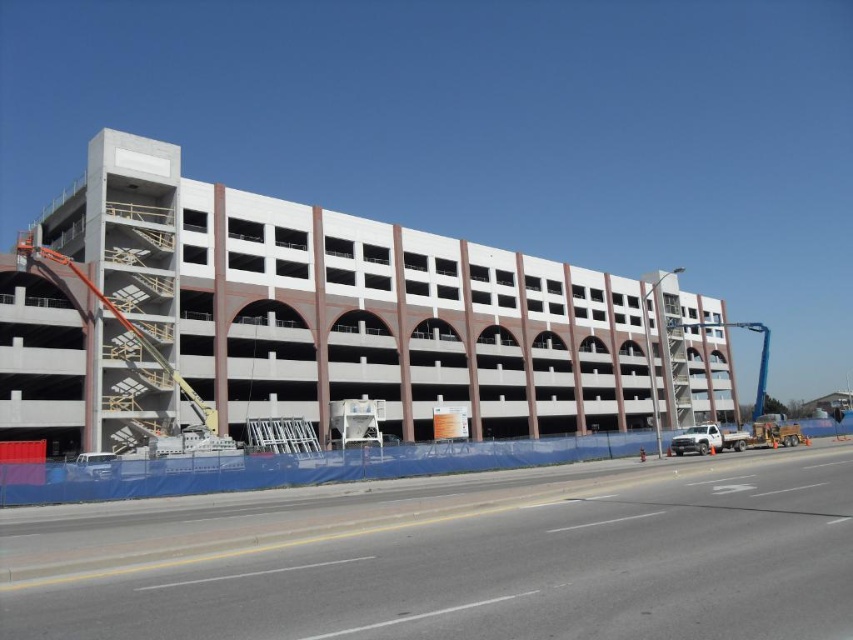
Is orange metallic crane at left taller than blue metallic crane at right?

No, orange metallic crane at left is not taller than blue metallic crane at right.

Identify the location of orange metallic crane at left. This screenshot has height=640, width=853. (126, 330).

Image resolution: width=853 pixels, height=640 pixels. What do you see at coordinates (126, 330) in the screenshot?
I see `orange metallic crane at left` at bounding box center [126, 330].

You are a GUI agent. You are given a task and a screenshot of the screen. Output one action in this format:
    pyautogui.click(x=<x>, y=<y>)
    Task: Click on the orange metallic crane at left
    The width and height of the screenshot is (853, 640).
    Given the screenshot: What is the action you would take?
    pyautogui.click(x=126, y=330)

Looking at this image, who is more distant from viewer, (526, 380) or (766, 368)?

Positioned behind is point (766, 368).

Does white concrete parking garage at center have a larger size compared to blue metallic crane at right?

No.

Is point (76, 376) behind point (752, 410)?

No.

The height and width of the screenshot is (640, 853). Find the location of `white concrete parking garage at center`. white concrete parking garage at center is located at coordinates [x=375, y=310].

Can you confirm if blue tarp at lower left is taller than blue metallic crane at right?

In fact, blue tarp at lower left may be shorter than blue metallic crane at right.

Can you confirm if blue tarp at lower left is positioned above blue metallic crane at right?

Correct, blue tarp at lower left is located above blue metallic crane at right.

Is point (683, 460) farther from viewer compared to point (762, 349)?

No.

I want to click on blue tarp at lower left, so click(x=456, y=557).